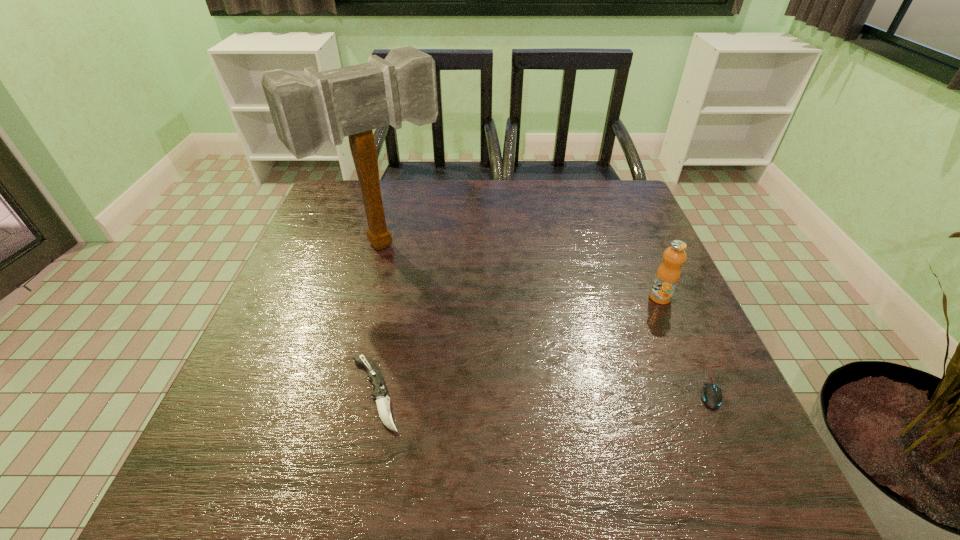
Where is `object located in the far left corner section of the desktop`? object located in the far left corner section of the desktop is located at coordinates (308, 110).

Where is `object located in the near right corner section of the desktop`? object located in the near right corner section of the desktop is located at coordinates (712, 397).

Identify the location of vacant space at the far edge of the desktop. (534, 191).

At what (x,y) coordinates should I click in order to perform the action: click on blank area at the left edge. Please return your answer as a coordinate pair (x, y). Looking at the image, I should click on (306, 357).

Find the location of a particular element. This screenshot has width=960, height=540. vacant region at the right edge is located at coordinates pos(637,253).

In order to click on free space at the far left corner of the desktop in this screenshot , I will do `click(347, 225)`.

You are a GUI agent. You are given a task and a screenshot of the screen. Output one action in this format:
    pyautogui.click(x=<x>, y=<y>)
    Task: Click on the free space at the near left corner of the desktop
    This screenshot has height=540, width=960.
    Given the screenshot: What is the action you would take?
    pyautogui.click(x=286, y=404)

At what (x,y) coordinates should I click in order to perform the action: click on vacant space at the near right corner of the desktop. Please return your answer as a coordinate pair (x, y). The height and width of the screenshot is (540, 960). Looking at the image, I should click on (745, 426).

The width and height of the screenshot is (960, 540). What are the coordinates of `vacant space in between the mouse and the tallest object` in the screenshot? It's located at (548, 314).

Where is `free point between the pocketknife and the mouse`? The height and width of the screenshot is (540, 960). free point between the pocketknife and the mouse is located at coordinates (544, 389).